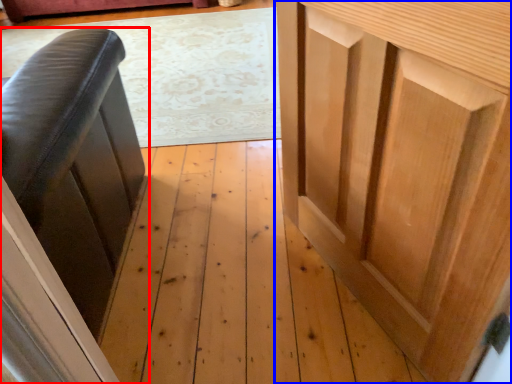
Question: Which object appears farthest to the camera in this image, furniture (highlighted by a red box) or cupboard (highlighted by a blue box)?

Choices:
 (A) furniture
 (B) cupboard

Answer: (A)